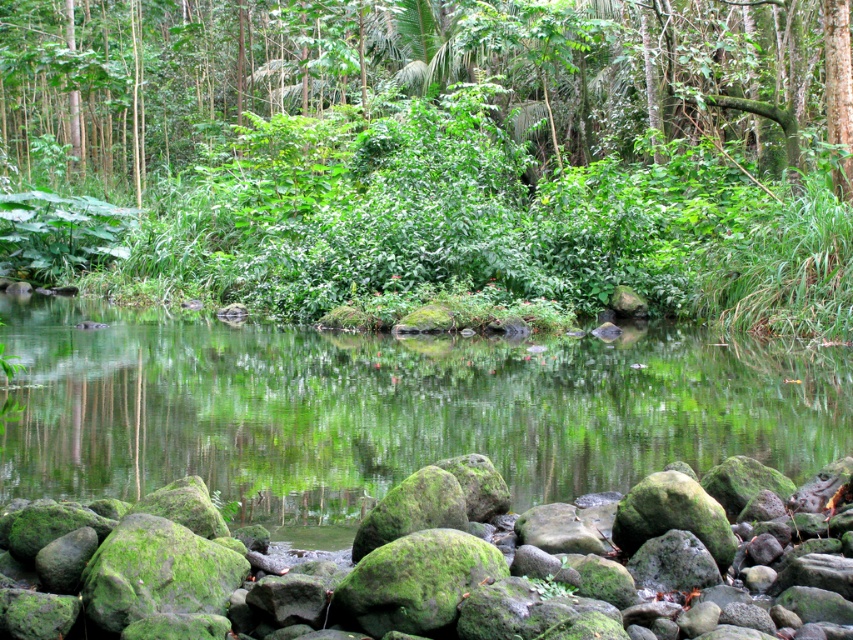
Question: Which point is closer to the camera?

Choices:
 (A) green mossy rock at lower center
 (B) green mossy rocks at center

Answer: (A)

Question: Among these objects, which one is nearest to the camera?

Choices:
 (A) green mossy rocks at center
 (B) green mossy rock at lower center

Answer: (B)

Question: Considering the relative positions of green mossy rocks at center and green mossy rock at lower center in the image provided, where is green mossy rocks at center located with respect to green mossy rock at lower center?

Choices:
 (A) below
 (B) above

Answer: (B)

Question: Which point is closer to the camera?

Choices:
 (A) green mossy rocks at center
 (B) green mossy rock at lower center

Answer: (B)

Question: Observing the image, what is the correct spatial positioning of green mossy rocks at center in reference to green mossy rock at lower center?

Choices:
 (A) above
 (B) below

Answer: (A)

Question: Does green mossy rocks at center appear under green mossy rock at lower center?

Choices:
 (A) yes
 (B) no

Answer: (B)